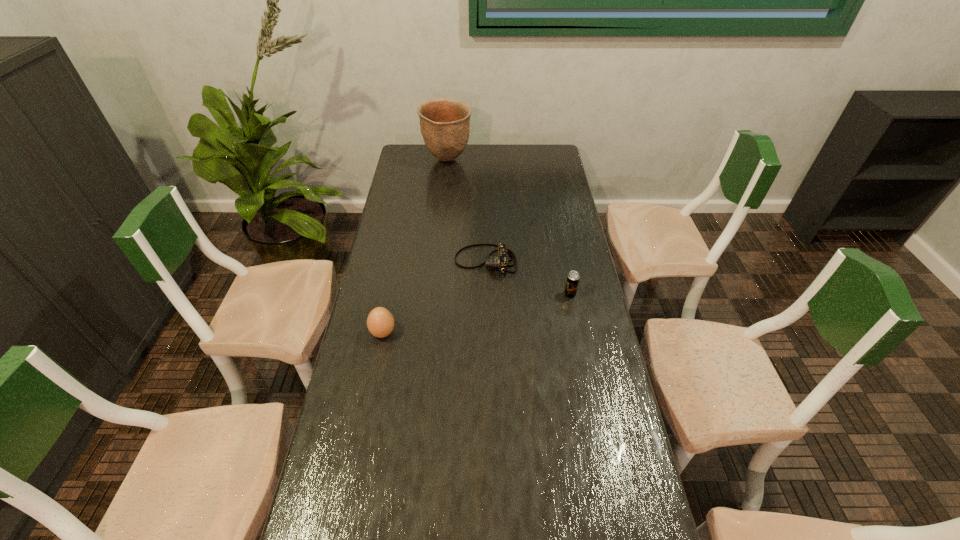
The height and width of the screenshot is (540, 960). I want to click on free space at the right edge of the desktop, so click(x=536, y=208).

At what (x,y) coordinates should I click in order to perform the action: click on vacant area at the far left corner. Please return your answer as a coordinate pair (x, y). Image resolution: width=960 pixels, height=540 pixels. Looking at the image, I should click on (400, 151).

Where is `vacant area at the far right corner`? The height and width of the screenshot is (540, 960). vacant area at the far right corner is located at coordinates (557, 166).

Where is `free space between the tallest object and the boiled egg`? Image resolution: width=960 pixels, height=540 pixels. free space between the tallest object and the boiled egg is located at coordinates (416, 247).

What are the coordinates of `vacant space in between the nearest object and the third nearest object` in the screenshot? It's located at (434, 298).

This screenshot has height=540, width=960. I want to click on blank region between the nearest object and the second nearest object, so (x=476, y=314).

The image size is (960, 540). I want to click on empty space that is in between the shortest object and the rightmost object, so click(528, 278).

Locate an element on the screen. This screenshot has height=540, width=960. blank region between the beer can and the shortest object is located at coordinates (528, 278).

Where is `free space between the nearest object and the rightmost object`? The width and height of the screenshot is (960, 540). free space between the nearest object and the rightmost object is located at coordinates (476, 314).

I want to click on free space between the boiled egg and the rightmost object, so click(476, 314).